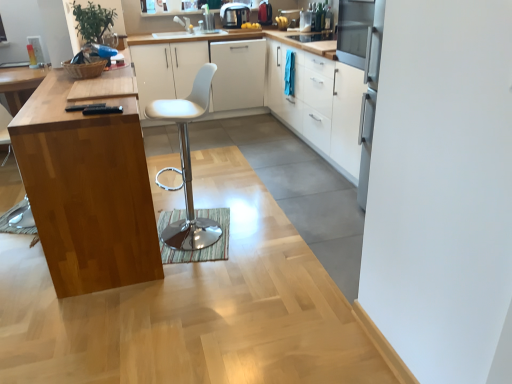
Question: Is wooden cutting board at left at the back of white matte cabinet at center, which ranks as the third cabinetry in right-to-left order?

Choices:
 (A) no
 (B) yes

Answer: (A)

Question: Is white matte cabinet at center, which ranks as the 2th cabinetry in left-to-right order, taller than wooden cutting board at left?

Choices:
 (A) yes
 (B) no

Answer: (B)

Question: Does white matte cabinet at center, which ranks as the third cabinetry in right-to-left order, appear on the right side of wooden cutting board at left?

Choices:
 (A) yes
 (B) no

Answer: (A)

Question: From a real-world perspective, is white matte cabinet at center, which ranks as the 2th cabinetry in left-to-right order, below wooden cutting board at left?

Choices:
 (A) yes
 (B) no

Answer: (A)

Question: Would you say white matte cabinet at center, which ranks as the third cabinetry in right-to-left order, contains wooden cutting board at left?

Choices:
 (A) yes
 (B) no

Answer: (B)

Question: Considering the positions of white matte cabinet at center, which ranks as the third cabinetry in right-to-left order, and wooden cutting board at left in the image, is white matte cabinet at center, which ranks as the third cabinetry in right-to-left order, taller or shorter than wooden cutting board at left?

Choices:
 (A) tall
 (B) short

Answer: (B)

Question: From a real-world perspective, relative to wooden cutting board at left, is white matte cabinet at center, which ranks as the 2th cabinetry in left-to-right order, vertically above or below?

Choices:
 (A) below
 (B) above

Answer: (A)

Question: Choose the correct answer: Is white matte cabinet at center, which ranks as the 2th cabinetry in left-to-right order, inside wooden cutting board at left or outside it?

Choices:
 (A) outside
 (B) inside

Answer: (A)

Question: Does point (244, 92) appear closer or farther from the camera than point (71, 127)?

Choices:
 (A) farther
 (B) closer

Answer: (A)

Question: From a real-world perspective, is white matte cabinet at center, marked as the 1th cabinetry in a left-to-right arrangement, positioned above or below metallic silver toaster at upper center, which ranks as the 2th appliance in right-to-left order?

Choices:
 (A) below
 (B) above

Answer: (A)

Question: Considering the positions of white matte cabinet at center, marked as the 1th cabinetry in a left-to-right arrangement, and metallic silver toaster at upper center, which is the 1th appliance in left-to-right order, in the image, is white matte cabinet at center, marked as the 1th cabinetry in a left-to-right arrangement, bigger or smaller than metallic silver toaster at upper center, which is the 1th appliance in left-to-right order,?

Choices:
 (A) small
 (B) big

Answer: (B)

Question: Is white matte cabinet at center, marked as the 1th cabinetry in a left-to-right arrangement, in front of or behind metallic silver toaster at upper center, which ranks as the 2th appliance in right-to-left order, in the image?

Choices:
 (A) behind
 (B) front

Answer: (B)

Question: Based on their positions, is white matte cabinet at center, the 4th cabinetry viewed from the right, located to the left or right of metallic silver toaster at upper center, which ranks as the 2th appliance in right-to-left order?

Choices:
 (A) left
 (B) right

Answer: (A)

Question: From the image's perspective, is wooden cutting board at left above or below metallic silver toaster at upper center, positioned as the 2th appliance in left-to-right order?

Choices:
 (A) above
 (B) below

Answer: (B)

Question: Based on their positions, is wooden cutting board at left located to the left or right of metallic silver toaster at upper center, the 1th appliance in the right-to-left sequence?

Choices:
 (A) right
 (B) left

Answer: (B)